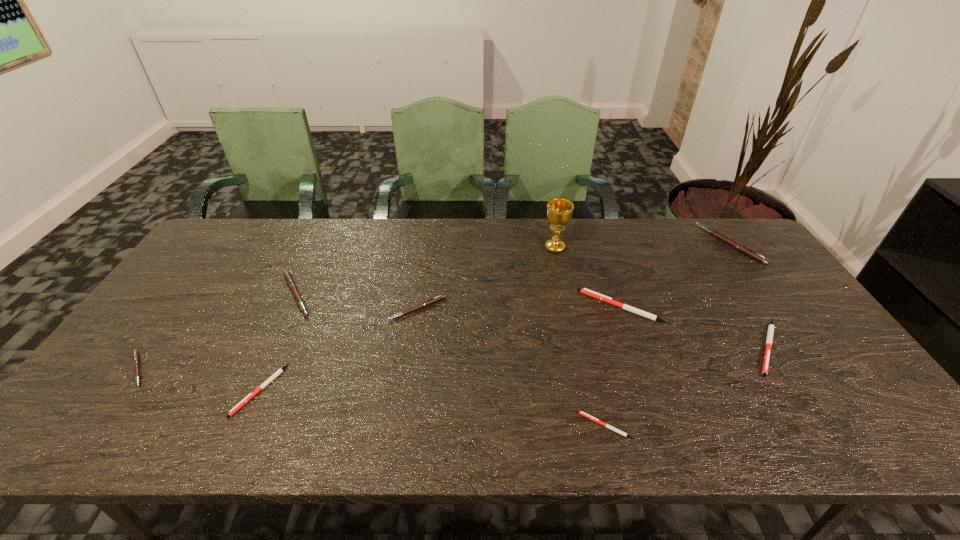
I want to click on gold chalice, so click(x=559, y=210).

Identify the location of chalice. This screenshot has width=960, height=540. (559, 210).

Find the location of a particular element. The image size is (960, 540). the rightmost pink pen is located at coordinates (743, 249).

Locate an element on the screen. The height and width of the screenshot is (540, 960). the tallest pen is located at coordinates (743, 249).

At what (x,y) coordinates should I click in order to perform the action: click on the third pink pen from right to left. Please return your answer as a coordinate pair (x, y). This screenshot has width=960, height=540. Looking at the image, I should click on (288, 277).

You are a GUI agent. You are given a task and a screenshot of the screen. Output one action in this format:
    pyautogui.click(x=<x>, y=<y>)
    Task: Click on the biggest white pen
    The width and height of the screenshot is (960, 540).
    Given the screenshot: What is the action you would take?
    pyautogui.click(x=585, y=291)

You are a GUI agent. You are given a task and a screenshot of the screen. Output one action in this format:
    pyautogui.click(x=<x>, y=<y>)
    Task: Click on the sixth object from right to left
    The height and width of the screenshot is (540, 960).
    Given the screenshot: What is the action you would take?
    pyautogui.click(x=430, y=301)

This screenshot has width=960, height=540. What are the coordinates of `the third pink pen from left to right` in the screenshot? It's located at (430, 301).

The image size is (960, 540). I want to click on the rightmost white pen, so click(771, 327).

This screenshot has height=540, width=960. In order to click on the leftmost pen in this screenshot , I will do pyautogui.click(x=135, y=352).